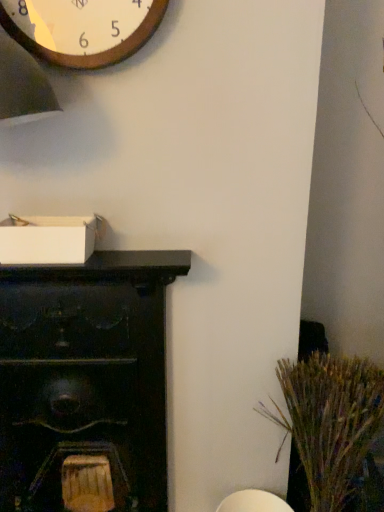
What do you see at coordinates (82, 29) in the screenshot? Image resolution: width=384 pixels, height=512 pixels. I see `wooden wall clock at upper left` at bounding box center [82, 29].

This screenshot has width=384, height=512. Describe the element at coordinates (85, 376) in the screenshot. I see `dark wood cabinet at left` at that location.

You are a GUI agent. You are given a task and a screenshot of the screen. Output one action in this format:
    pyautogui.click(x=<x>, y=<y>)
    Task: Click on the dry grass at right
    
    Given the screenshot: What is the action you would take?
    pyautogui.click(x=329, y=420)

This screenshot has height=512, width=384. I want to click on wooden wall clock at upper left, so click(82, 29).

Is dark wood cabinet at left positioned behind dry grass at right?

That is True.

Would you say dark wood cabinet at left is a long distance from dry grass at right?

dark wood cabinet at left is actually quite close to dry grass at right.

Locate an element on the screen. The image size is (384, 512). furniture that appears above the dry grass at right (from a real-world perspective) is located at coordinates (85, 376).

From the image's perspective, which is below, dark wood cabinet at left or dry grass at right?

dry grass at right.

Considering the relative positions of wooden wall clock at upper left and dark wood cabinet at left in the image provided, is wooden wall clock at upper left to the left of dark wood cabinet at left from the viewer's perspective?

Incorrect, wooden wall clock at upper left is not on the left side of dark wood cabinet at left.

From a real-world perspective, does wooden wall clock at upper left sit lower than dark wood cabinet at left?

No, from a real-world perspective, wooden wall clock at upper left is not below dark wood cabinet at left.

Who is smaller, wooden wall clock at upper left or dark wood cabinet at left?

wooden wall clock at upper left is smaller.

Is dark wood cabinet at left oriented towards wooden wall clock at upper left?

No, dark wood cabinet at left is not aimed at wooden wall clock at upper left.

Which of these two, dark wood cabinet at left or wooden wall clock at upper left, stands shorter?

With less height is wooden wall clock at upper left.

From the picture: Between dark wood cabinet at left and wooden wall clock at upper left, which one has smaller size?

wooden wall clock at upper left.

From a real-world perspective, which is physically below, dark wood cabinet at left or wooden wall clock at upper left?

In real-world perspective, dark wood cabinet at left is lower.

Between wooden wall clock at upper left and dry grass at right, which one has smaller size?

wooden wall clock at upper left.

Is dry grass at right at the back of wooden wall clock at upper left?

No, dry grass at right is not at the back of wooden wall clock at upper left.

Based on their positions, is wooden wall clock at upper left located to the left or right of dry grass at right?

wooden wall clock at upper left is positioned on dry grass at right's left side.

Is point (118, 52) positioned before point (318, 480)?

That is True.

How different are the orientations of dry grass at right and dark wood cabinet at left in degrees?

dry grass at right and dark wood cabinet at left are facing 0.741 degrees away from each other.

Does dry grass at right appear on the right side of dark wood cabinet at left?

Yes, dry grass at right is to the right of dark wood cabinet at left.

Is dark wood cabinet at left at the back of dry grass at right?

No, dark wood cabinet at left is not at the back of dry grass at right.

Is dry grass at right completely or partially outside of dark wood cabinet at left?

dry grass at right is positioned outside dark wood cabinet at left.

Is dry grass at right bigger than wooden wall clock at upper left?

Yes, dry grass at right is bigger than wooden wall clock at upper left.

Is dry grass at right oriented towards wooden wall clock at upper left?

No, dry grass at right is not oriented towards wooden wall clock at upper left.

Is point (316, 478) closer to camera compared to point (42, 57)?

No, (316, 478) is behind (42, 57).

Considering the relative positions of dry grass at right and wooden wall clock at upper left in the image provided, is dry grass at right to the left or to the right of wooden wall clock at upper left?

Based on their positions, dry grass at right is located to the right of wooden wall clock at upper left.

Find the location of a particular element. This screenshot has width=384, height=512. plant in front of the dark wood cabinet at left is located at coordinates (329, 420).

Image resolution: width=384 pixels, height=512 pixels. Find the location of `wall clock above the dark wood cabinet at left (from a real-world perspective)`. wall clock above the dark wood cabinet at left (from a real-world perspective) is located at coordinates (82, 29).

Estimate the real-world distances between objects in this image. Which object is further from wooden wall clock at upper left, dark wood cabinet at left or dry grass at right?

dry grass at right lies further to wooden wall clock at upper left than the other object.

Consider the image. Which object lies nearer to the anchor point dry grass at right, wooden wall clock at upper left or dark wood cabinet at left?

Among the two, dark wood cabinet at left is located nearer to dry grass at right.

Estimate the real-world distances between objects in this image. Which object is closer to wooden wall clock at upper left, dry grass at right or dark wood cabinet at left?

The object closer to wooden wall clock at upper left is dark wood cabinet at left.

Based on their spatial positions, is wooden wall clock at upper left or dry grass at right further from dark wood cabinet at left?

wooden wall clock at upper left is further to dark wood cabinet at left.

Which object lies further to the anchor point dark wood cabinet at left, dry grass at right or wooden wall clock at upper left?

wooden wall clock at upper left is further to dark wood cabinet at left.

Looking at the image, which one is located closer to dry grass at right, dark wood cabinet at left or wooden wall clock at upper left?

dark wood cabinet at left is positioned closer to the anchor dry grass at right.

Where is `furniture between wooden wall clock at upper left and dry grass at right vertically`? Image resolution: width=384 pixels, height=512 pixels. furniture between wooden wall clock at upper left and dry grass at right vertically is located at coordinates (85, 376).